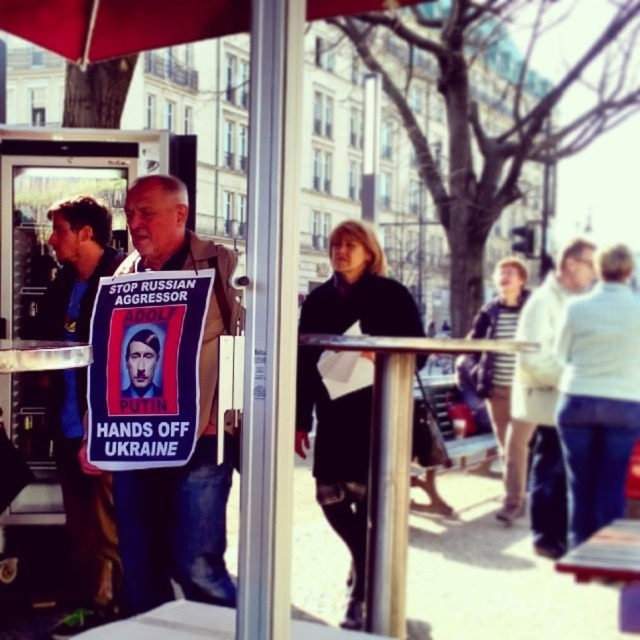
Question: Which of the following is the closest to the observer?

Choices:
 (A) (545, 520)
 (B) (65, 28)
 (C) (209, 362)

Answer: (B)

Question: Which object appears closest to the camera in this image?

Choices:
 (A) red fabric umbrella at upper left
 (B) matte cardboard sign at center
 (C) white cotton shirt at right
 (D) matte black sign at center

Answer: (A)

Question: Is matte black sign at center wider than white cotton shirt at right?

Choices:
 (A) no
 (B) yes

Answer: (A)

Question: Considering the real-world distances, which object is farthest from the matte black sign at center?

Choices:
 (A) white cotton shirt at right
 (B) red fabric umbrella at upper left

Answer: (A)

Question: Does matte black sign at center appear over white cotton shirt at right?

Choices:
 (A) no
 (B) yes

Answer: (B)

Question: Considering the relative positions of blue fabric poster at center and matte black sign at center in the image provided, where is blue fabric poster at center located with respect to matte black sign at center?

Choices:
 (A) left
 (B) right

Answer: (B)